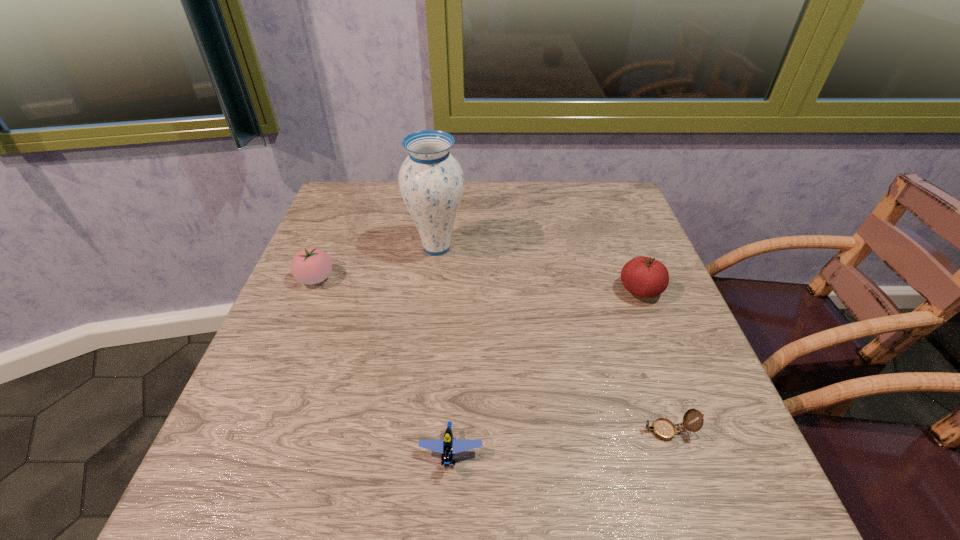
The image size is (960, 540). I want to click on free spot located 0.330m on the face of the compass, so click(x=438, y=430).

I want to click on vacant region located on the face of the compass, so click(x=604, y=430).

Find the location of a particular element. vacant space located on the face of the compass is located at coordinates (561, 430).

Identify the location of object positioned at the near edge. (448, 446).

At what (x,y) coordinates should I click in order to perform the action: click on object that is at the left edge. Please return your answer as a coordinate pair (x, y). The image size is (960, 540). Looking at the image, I should click on (311, 265).

Locate an element on the screen. tomato at the right edge is located at coordinates [x=642, y=276].

Locate an element on the screen. The height and width of the screenshot is (540, 960). compass present at the right edge is located at coordinates (664, 429).

I want to click on vacant space at the far edge of the desktop, so click(483, 195).

Where is `free region at the near edge of the desktop`? Image resolution: width=960 pixels, height=540 pixels. free region at the near edge of the desktop is located at coordinates [x=372, y=496].

Locate an element on the screen. The image size is (960, 540). vacant region at the left edge is located at coordinates (300, 350).